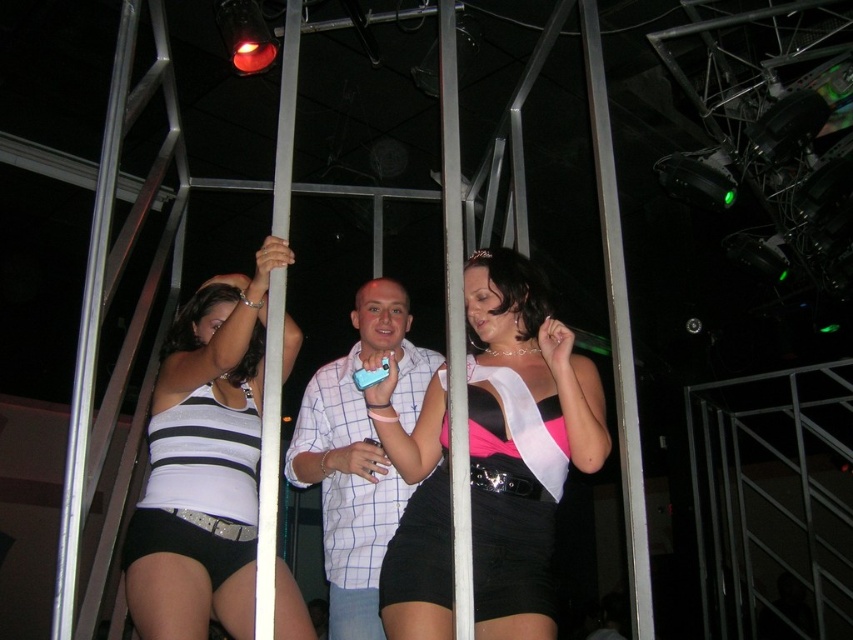
Question: Which of the following is the farthest from the observer?

Choices:
 (A) (381, 582)
 (B) (195, 330)

Answer: (B)

Question: From the image, what is the correct spatial relationship of white striped tank top at left in relation to black satin shorts at lower left?

Choices:
 (A) left
 (B) right

Answer: (B)

Question: Does white striped tank top at left appear under black satin shorts at center?

Choices:
 (A) yes
 (B) no

Answer: (B)

Question: Which of the following is the farthest from the observer?

Choices:
 (A) (253, 550)
 (B) (495, 301)
 (C) (511, 596)

Answer: (A)

Question: Can you confirm if matte black dress at center is positioned below white striped tank top at left?

Choices:
 (A) no
 (B) yes

Answer: (A)

Question: Estimate the real-world distances between objects in this image. Which object is farther from the white checkered shirt at center?

Choices:
 (A) black satin shorts at center
 (B) black satin shorts at lower left
 (C) white striped tank top at left

Answer: (B)